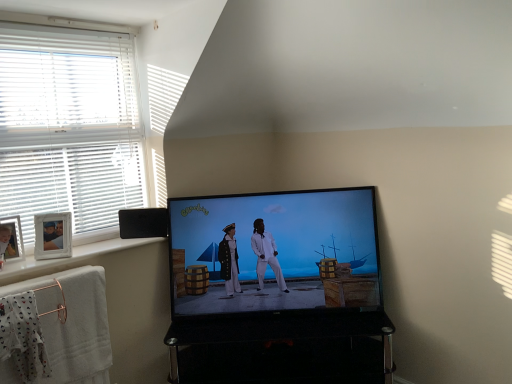
Question: Is shiny black screen at center bigger than white blinds at left?

Choices:
 (A) no
 (B) yes

Answer: (A)

Question: From the image's perspective, does shiny black screen at center appear lower than white blinds at left?

Choices:
 (A) yes
 (B) no

Answer: (A)

Question: Can you confirm if shiny black screen at center is taller than white blinds at left?

Choices:
 (A) no
 (B) yes

Answer: (A)

Question: Considering the relative sizes of shiny black screen at center and white blinds at left in the image provided, is shiny black screen at center shorter than white blinds at left?

Choices:
 (A) no
 (B) yes

Answer: (B)

Question: From the image's perspective, is shiny black screen at center on top of white blinds at left?

Choices:
 (A) yes
 (B) no

Answer: (B)

Question: In terms of size, does white blinds at left appear bigger or smaller than white cotton bath towel at lower left?

Choices:
 (A) small
 (B) big

Answer: (B)

Question: Looking at their shapes, would you say white blinds at left is wider or thinner than white cotton bath towel at lower left?

Choices:
 (A) wide
 (B) thin

Answer: (A)

Question: From a real-world perspective, relative to white cotton bath towel at lower left, is white blinds at left vertically above or below?

Choices:
 (A) above
 (B) below

Answer: (A)

Question: Is white blinds at left in front of or behind white cotton bath towel at lower left in the image?

Choices:
 (A) front
 (B) behind

Answer: (B)

Question: Considering the positions of point (346, 240) and point (13, 309), is point (346, 240) closer or farther from the camera than point (13, 309)?

Choices:
 (A) farther
 (B) closer

Answer: (A)

Question: From the image's perspective, is shiny black screen at center positioned above or below white cotton cloth at lower left?

Choices:
 (A) above
 (B) below

Answer: (A)

Question: Considering the positions of shiny black screen at center and white cotton cloth at lower left in the image, is shiny black screen at center taller or shorter than white cotton cloth at lower left?

Choices:
 (A) tall
 (B) short

Answer: (A)

Question: From a real-world perspective, is shiny black screen at center positioned above or below white cotton cloth at lower left?

Choices:
 (A) above
 (B) below

Answer: (A)

Question: From the image's perspective, is wooden photo frame at left located above or below white cotton cloth at lower left?

Choices:
 (A) below
 (B) above

Answer: (B)

Question: Considering the positions of wooden photo frame at left and white cotton cloth at lower left in the image, is wooden photo frame at left wider or thinner than white cotton cloth at lower left?

Choices:
 (A) wide
 (B) thin

Answer: (B)